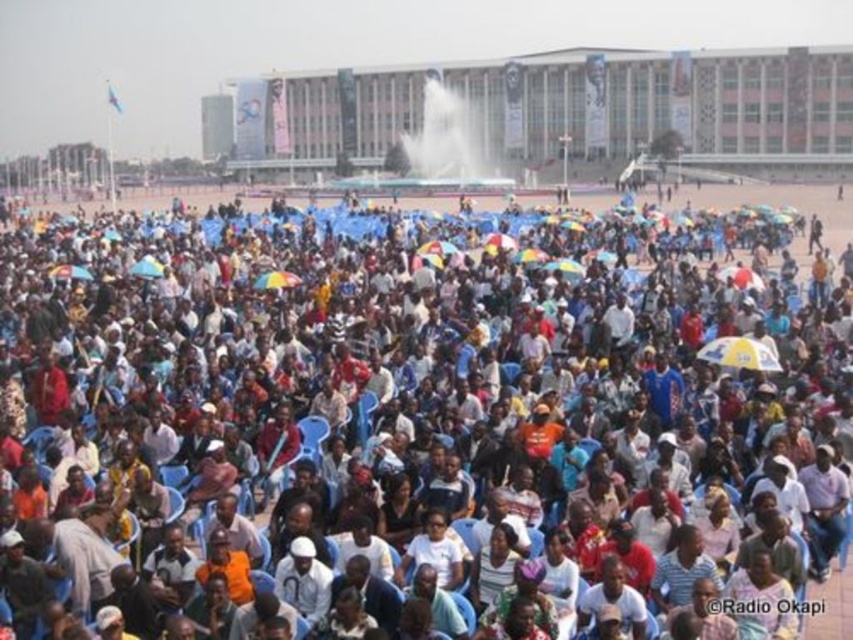
Question: Does white plastic chairs at center have a larger size compared to yellowmaterial/textureumbrella at center?

Choices:
 (A) no
 (B) yes

Answer: (B)

Question: Which object is closer to the camera taking this photo?

Choices:
 (A) white plastic chairs at center
 (B) yellowmaterial/textureumbrella at center

Answer: (A)

Question: Which object appears closest to the camera in this image?

Choices:
 (A) white plastic chairs at center
 (B) yellowmaterial/textureumbrella at center

Answer: (A)

Question: Does white plastic chairs at center appear under yellowmaterial/textureumbrella at center?

Choices:
 (A) no
 (B) yes

Answer: (A)

Question: Is white plastic chairs at center bigger than yellowmaterial/textureumbrella at center?

Choices:
 (A) no
 (B) yes

Answer: (B)